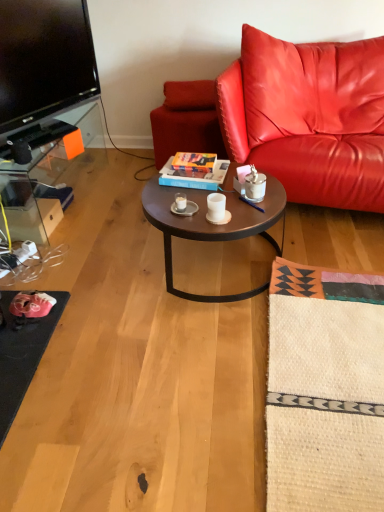
Where is `unoccupied space behind white matte cup at center, which is the second coffee cup in back-to-front order`? unoccupied space behind white matte cup at center, which is the second coffee cup in back-to-front order is located at coordinates (210, 195).